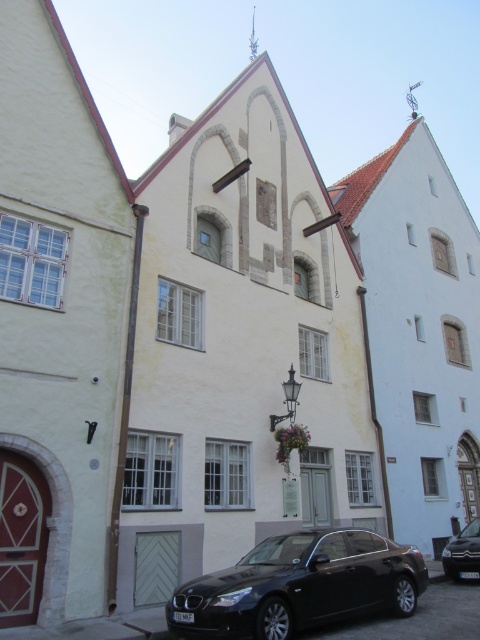
You are a delivery person needing to park a 15 feet long truck between the black metallic car at lower center and the black glossy car at lower center. Can you fit the truck in the space between them?

The distance between the black metallic car at lower center and the black glossy car at lower center is 43.96 feet, which is more than enough to accommodate a 15 feet long truck.

You are a pedestrian standing on the sidewalk and see the two cars, the black metallic car at lower center and the black glossy car at lower center. Which one is positioned to the left side?

The black metallic car at lower center is positioned to the left of the black glossy car at lower center.